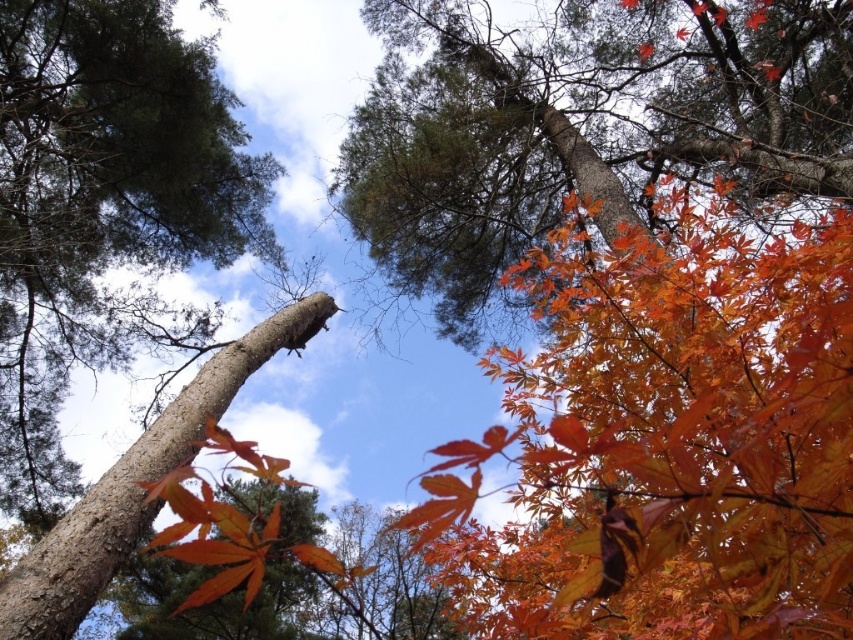
Is orange matte leaves at upper center taller than shiny orange maple leaf at center?

Yes.

Who is lower down, orange matte leaves at upper center or shiny orange maple leaf at center?

shiny orange maple leaf at center

Is point (480, 268) closer to viewer compared to point (466, 465)?

That is True.

This screenshot has height=640, width=853. In order to click on orange matte leaves at upper center in this screenshot , I will do `click(581, 125)`.

Between point (151, 125) and point (80, 506), which one is positioned in front?

Point (80, 506) is in front.

Does smooth bark tree trunk at left have a greater width compared to smooth brown tree trunk at center?

Indeed, smooth bark tree trunk at left has a greater width compared to smooth brown tree trunk at center.

Between point (1, 92) and point (177, 435), which one is positioned in front?

Positioned in front is point (177, 435).

Image resolution: width=853 pixels, height=640 pixels. In order to click on smooth bark tree trunk at left in this screenshot , I will do `click(103, 209)`.

Can you confirm if orange matte maple leaf at center is positioned to the left of shiny orange maple leaf at center?

Correct, you'll find orange matte maple leaf at center to the left of shiny orange maple leaf at center.

Does orange matte maple leaf at center appear under shiny orange maple leaf at center?

Incorrect, orange matte maple leaf at center is not positioned below shiny orange maple leaf at center.

Image resolution: width=853 pixels, height=640 pixels. In order to click on orange matte maple leaf at center in this screenshot , I will do `click(213, 538)`.